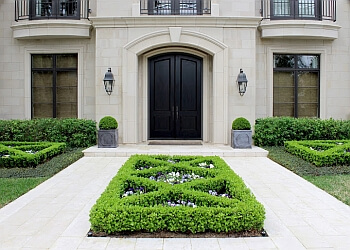
The height and width of the screenshot is (250, 350). Find the location of `planter to the right of the door`. planter to the right of the door is located at coordinates (240, 126).